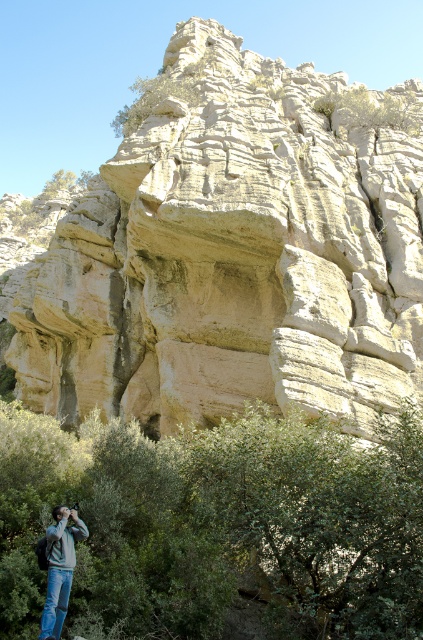
You are a hiker trying to decide whether to set up your tent near the light beige stone cliff at center or the denim jacket at lower left. Which location offers more space for your tent?

The light beige stone cliff at center has a larger width than the denim jacket at lower left, so setting up the tent near the light beige stone cliff at center would provide more space.

Based on the photo, you are standing in front of the light beige stone cliff at center and the denim jacket at lower left. Which object is higher in elevation?

The light beige stone cliff at center is higher in elevation than the denim jacket at lower left because it is located above it.